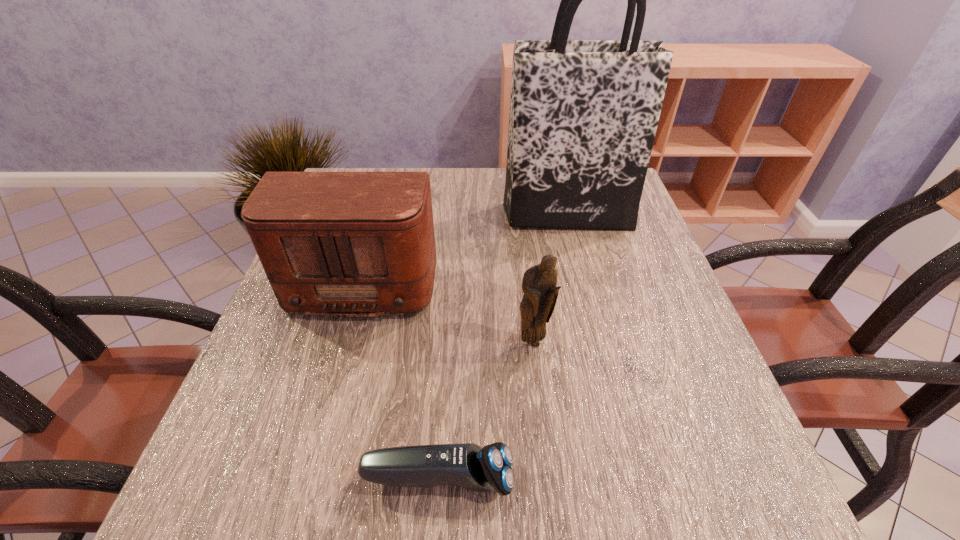
Locate an element on the screen. This screenshot has width=960, height=540. the farthest object is located at coordinates (583, 116).

This screenshot has height=540, width=960. I want to click on shopping bag, so point(583,116).

Locate an element on the screen. The image size is (960, 540). radio receiver is located at coordinates (348, 244).

Where is `figurine`? figurine is located at coordinates (539, 282).

The image size is (960, 540). Identify the location of electric shaver. coord(467,465).

Find the location of a particular element. Image resolution: width=960 pixels, height=540 pixels. the nearest object is located at coordinates (467, 465).

The image size is (960, 540). Identify the location of vacant region located 0.110m on the front of the tallest object with the design. (578, 261).

At what (x,y) coordinates should I click in order to perform the action: click on free space located on the front panel of the radio receiver. Please return your answer as a coordinate pair (x, y). Looking at the image, I should click on (303, 501).

The image size is (960, 540). What are the coordinates of `vacant space located on the front-facing side of the second nearest object` in the screenshot? It's located at (551, 505).

Identify the location of free space located on the head of the nearest object. This screenshot has height=540, width=960. (762, 479).